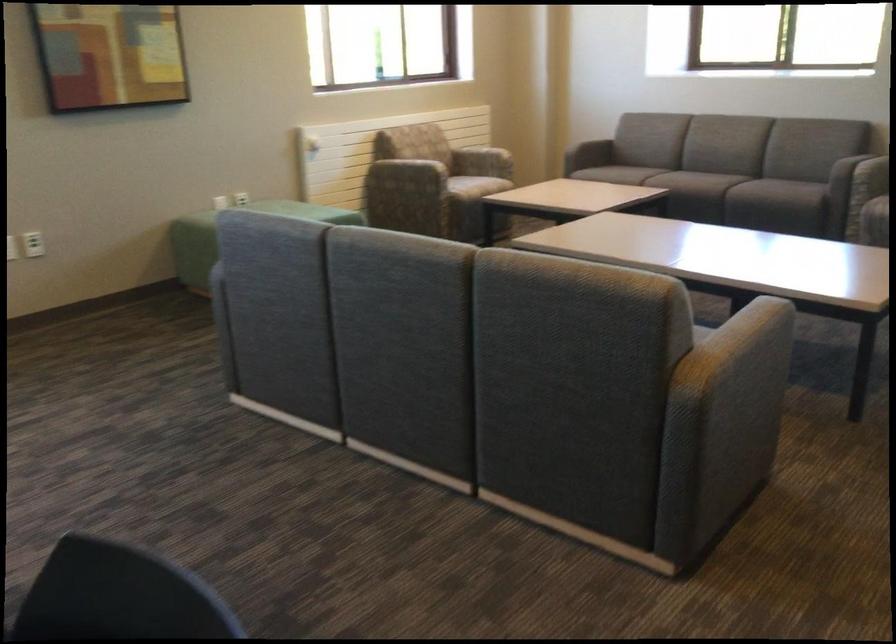
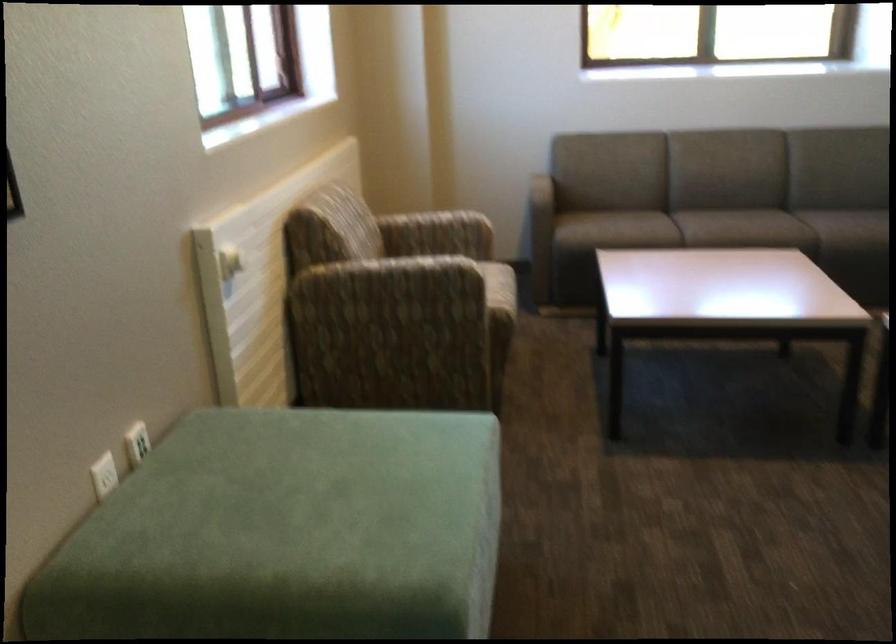
Where in the second image is the point corresponding to (x=231, y=194) from the first image?

(136, 442)